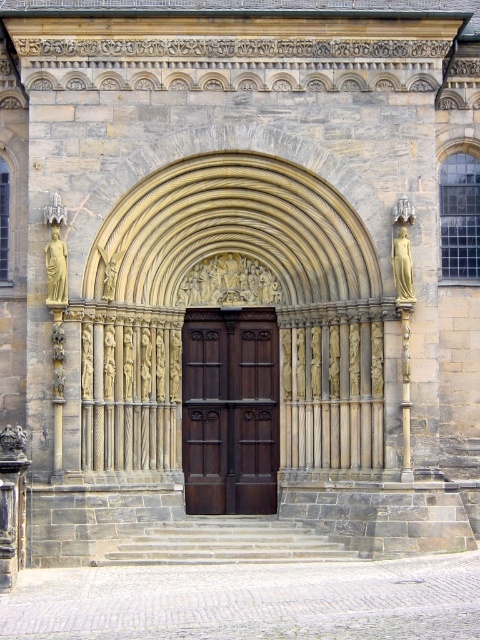
Consider the image. Does dark wood door at center have a lesser height compared to golden stone statue at center?

No.

Measure the distance between point (276, 404) and camera.

Point (276, 404) is 238.52 feet away from camera.

Image resolution: width=480 pixels, height=640 pixels. In order to click on dark wood door at center in this screenshot , I will do click(229, 410).

Is golden stone statue at left wider than golden stone statue at right?

Indeed, golden stone statue at left has a greater width compared to golden stone statue at right.

Does golden stone statue at left appear on the right side of golden stone statue at right?

In fact, golden stone statue at left is to the left of golden stone statue at right.

Describe the element at coordinates (56, 268) in the screenshot. The height and width of the screenshot is (640, 480). I see `golden stone statue at left` at that location.

Image resolution: width=480 pixels, height=640 pixels. I want to click on golden stone statue at left, so click(56, 268).

Consider the image. Is golden stone statue at left bigger than golden stone statue at center?

Correct, golden stone statue at left is larger in size than golden stone statue at center.

Between point (64, 262) and point (113, 282), which one is positioned in front?

Positioned in front is point (64, 262).

Between point (66, 253) and point (104, 296), which one is positioned in front?

Point (66, 253) is more forward.

The image size is (480, 640). I want to click on golden stone statue at left, so click(56, 268).